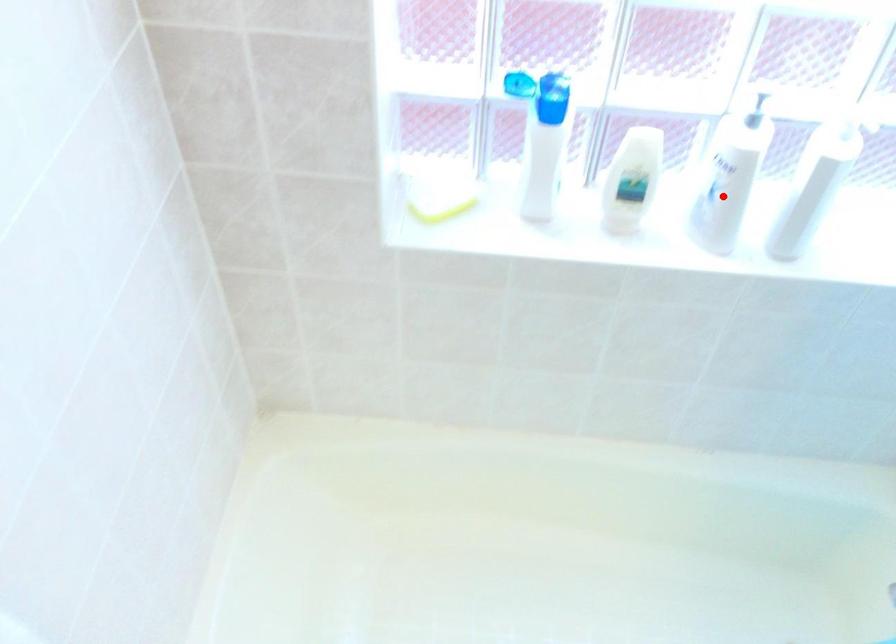
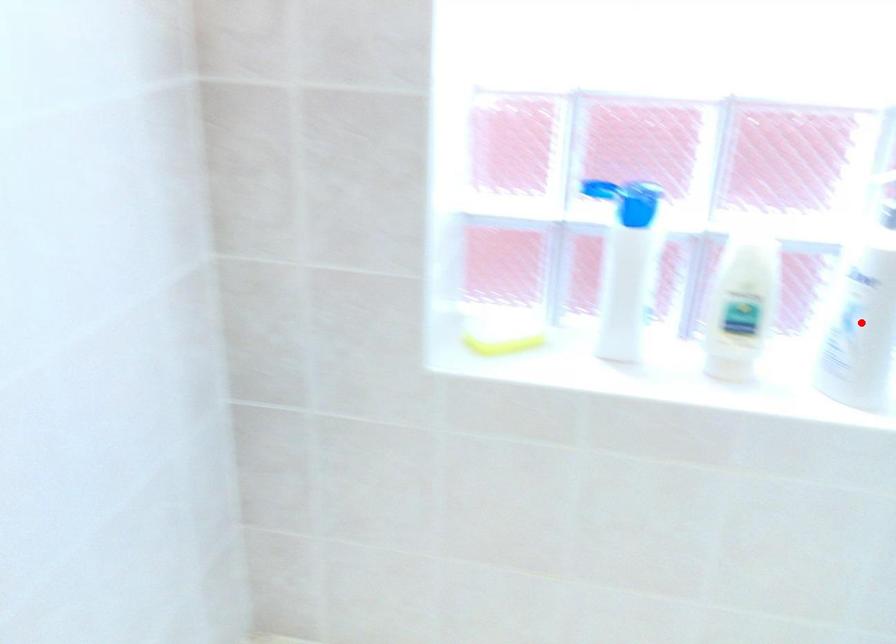
I am providing you with two images of the same scene from different viewpoints. A red point is marked on the first image and another point is marked on the second image. Is the marked point in image1 the same physical position as the marked point in image2?

Yes